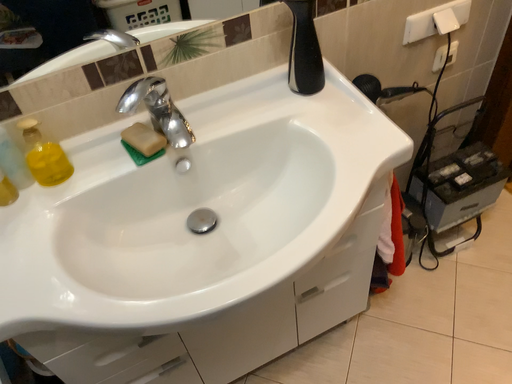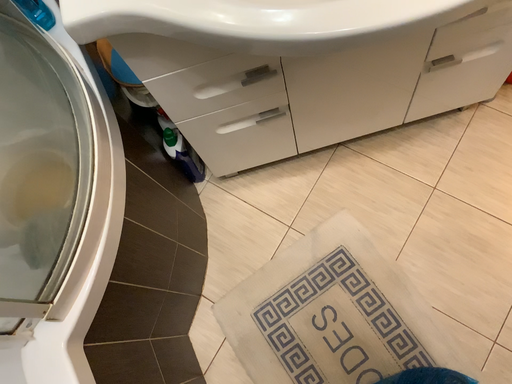
Question: Which way did the camera rotate in the video?

Choices:
 (A) rotated right
 (B) rotated left

Answer: (B)